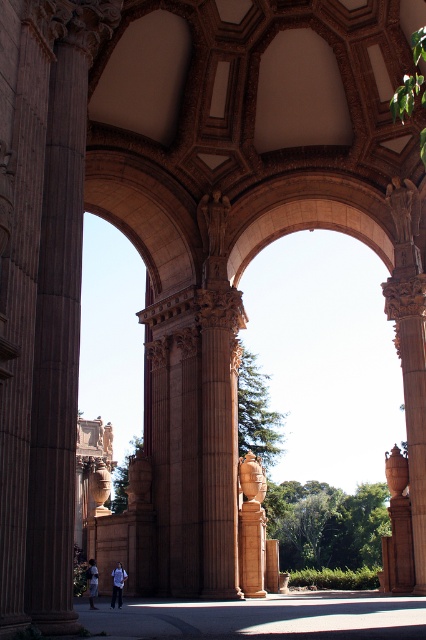
Question: Which object is the farthest from the brown polished stone column at left?

Choices:
 (A) smooth tan stone column at center
 (B) denim pants at lower left

Answer: (B)

Question: Is brown stone vase at right to the right of white cotton shirt at lower center from the viewer's perspective?

Choices:
 (A) no
 (B) yes

Answer: (B)

Question: Which point is farther to the camera?

Choices:
 (A) denim pants at lower left
 (B) brown stone vase at right
 (C) brown polished stone column at left
 (D) white cotton shirt at lower center

Answer: (A)

Question: Can you confirm if brown stone vase at right is thinner than white cotton shirt at lower center?

Choices:
 (A) yes
 (B) no

Answer: (A)

Question: Which point appears closest to the camera in this image?

Choices:
 (A) (249, 561)
 (B) (118, 605)
 (C) (63, 161)
 (D) (405, 550)

Answer: (C)

Question: Does brown stone vase at right have a larger size compared to denim pants at lower left?

Choices:
 (A) yes
 (B) no

Answer: (B)